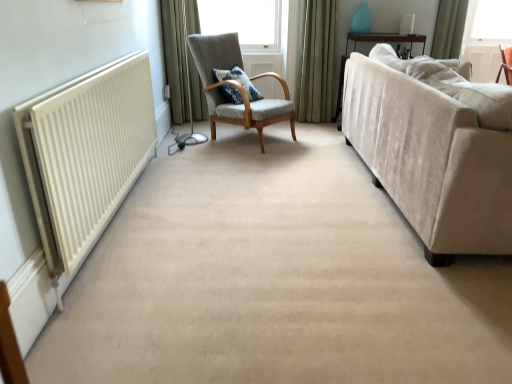
Question: Is the depth of white matte radiator at left greater than that of green fabric curtain at upper right, marked as the 1th curtain in a right-to-left arrangement?

Choices:
 (A) yes
 (B) no

Answer: (B)

Question: Is green fabric curtain at upper right, which is counted as the 3th curtain, starting from the left, surrounded by white matte radiator at left?

Choices:
 (A) no
 (B) yes

Answer: (A)

Question: Does white matte radiator at left have a greater width compared to green fabric curtain at upper right, which is counted as the 3th curtain, starting from the left?

Choices:
 (A) yes
 (B) no

Answer: (B)

Question: Is white matte radiator at left placed right next to green fabric curtain at upper right, marked as the 1th curtain in a right-to-left arrangement?

Choices:
 (A) yes
 (B) no

Answer: (B)

Question: Is white matte radiator at left oriented away from green fabric curtain at upper right, which is counted as the 3th curtain, starting from the left?

Choices:
 (A) yes
 (B) no

Answer: (B)

Question: Is point (499, 150) positioned closer to the camera than point (15, 117)?

Choices:
 (A) closer
 (B) farther

Answer: (B)

Question: Considering the relative positions of beige velvet couch at right and white matte radiator at left in the image provided, is beige velvet couch at right to the left or to the right of white matte radiator at left?

Choices:
 (A) right
 (B) left

Answer: (A)

Question: From the image's perspective, is beige velvet couch at right located above or below white matte radiator at left?

Choices:
 (A) below
 (B) above

Answer: (B)

Question: From a real-world perspective, is beige velvet couch at right positioned above or below white matte radiator at left?

Choices:
 (A) below
 (B) above

Answer: (B)

Question: Is green velvet curtain at upper center, placed as the second curtain when sorted from right to left, wider or thinner than green fabric curtain at upper right, which is counted as the 3th curtain, starting from the left?

Choices:
 (A) wide
 (B) thin

Answer: (B)

Question: From the image's perspective, is green velvet curtain at upper center, placed as the second curtain when sorted from right to left, located above or below green fabric curtain at upper right, marked as the 1th curtain in a right-to-left arrangement?

Choices:
 (A) below
 (B) above

Answer: (A)

Question: Is green velvet curtain at upper center, marked as the second curtain in a left-to-right arrangement, to the left or to the right of green fabric curtain at upper right, marked as the 1th curtain in a right-to-left arrangement, in the image?

Choices:
 (A) left
 (B) right

Answer: (A)

Question: Relative to green fabric curtain at upper right, marked as the 1th curtain in a right-to-left arrangement, is green velvet curtain at upper center, placed as the second curtain when sorted from right to left, in front or behind?

Choices:
 (A) front
 (B) behind

Answer: (A)

Question: From a real-world perspective, is beige velvet couch at right physically located above or below green fabric curtain at upper right, which is counted as the 3th curtain, starting from the left?

Choices:
 (A) above
 (B) below

Answer: (B)

Question: From the image's perspective, relative to green fabric curtain at upper right, which is counted as the 3th curtain, starting from the left, is beige velvet couch at right above or below?

Choices:
 (A) below
 (B) above

Answer: (A)